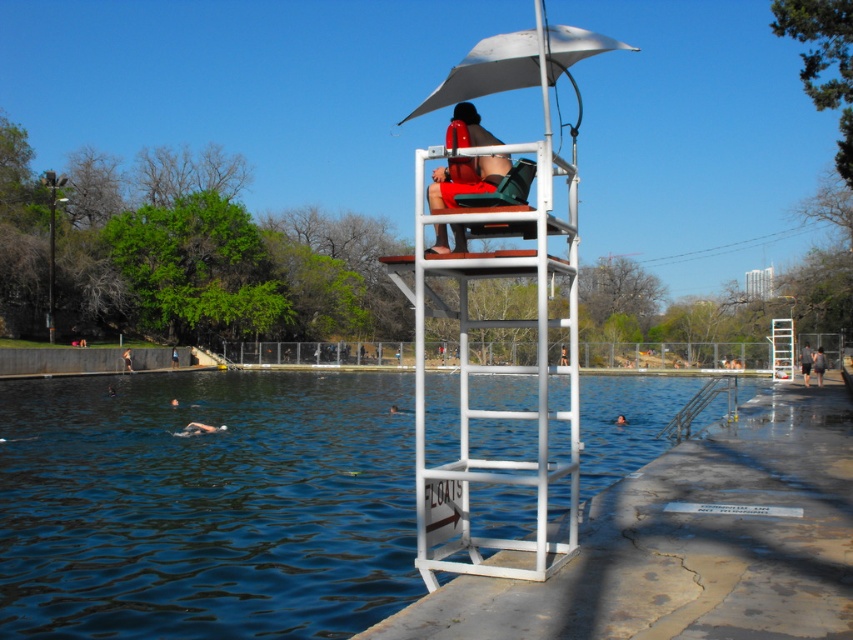
You are a swimmer looking to retrieve your belongings. You see a matte red life vest at center and a blue fabric shirt at upper center. Which item is positioned to the right of the other?

The matte red life vest at center is to the right of the blue fabric shirt at upper center.

You are a swimmer looking to get out of the pool. You see the clear blue water at center and the white matte umbrella at upper center. Which object is taller?

The white matte umbrella at upper center is taller than the clear blue water at center.

You are a swimmer looking to get out of the pool. You see the clear blue water at center and the white plastic ladder at center. Which direction should you swim to reach the ladder?

The clear blue water at center is to the left of the white plastic ladder at center, so you should swim to the right to reach the ladder.